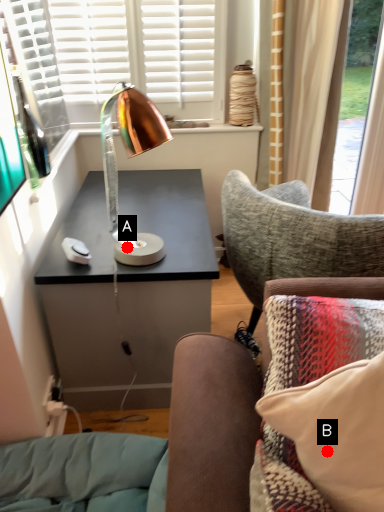
Question: Two points are circled on the image, labeled by A and B beside each circle. Which point is farther from the camera taking this photo?

Choices:
 (A) A is further
 (B) B is further

Answer: (A)